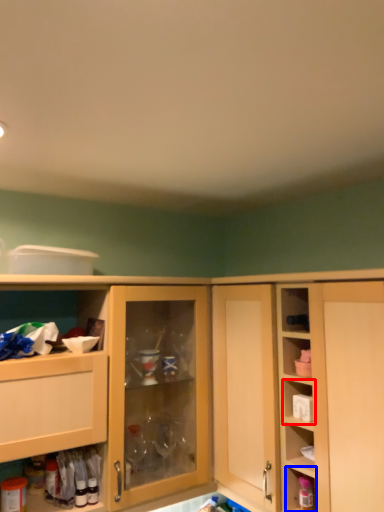
Question: Which object appears closest to the camera in this image, shelf (highlighted by a red box) or cabinet (highlighted by a blue box)?

Choices:
 (A) shelf
 (B) cabinet

Answer: (B)